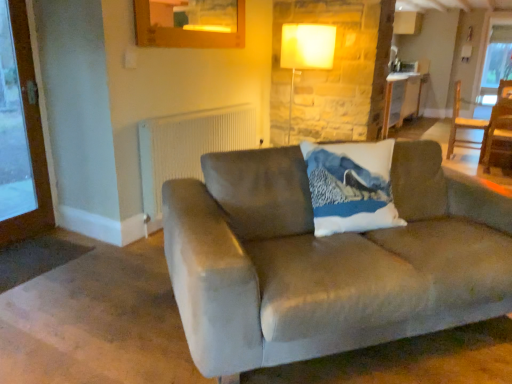
Question: Is wooden chair at right to the right of matte white lamp at upper center from the viewer's perspective?

Choices:
 (A) yes
 (B) no

Answer: (A)

Question: From the image's perspective, does wooden chair at right appear lower than matte white lamp at upper center?

Choices:
 (A) yes
 (B) no

Answer: (A)

Question: From a real-world perspective, is wooden chair at right below matte white lamp at upper center?

Choices:
 (A) no
 (B) yes

Answer: (B)

Question: Is wooden chair at right taller than matte white lamp at upper center?

Choices:
 (A) no
 (B) yes

Answer: (A)

Question: Can you confirm if wooden chair at right is positioned to the left of matte white lamp at upper center?

Choices:
 (A) no
 (B) yes

Answer: (A)

Question: Is suede couch at center wider or thinner than matte white lamp at upper center?

Choices:
 (A) wide
 (B) thin

Answer: (A)

Question: Considering the positions of suede couch at center and matte white lamp at upper center in the image, is suede couch at center taller or shorter than matte white lamp at upper center?

Choices:
 (A) tall
 (B) short

Answer: (B)

Question: Is suede couch at center in front of or behind matte white lamp at upper center in the image?

Choices:
 (A) front
 (B) behind

Answer: (A)

Question: Is point (206, 213) positioned closer to the camera than point (292, 92)?

Choices:
 (A) farther
 (B) closer

Answer: (B)

Question: From the image's perspective, is matte white lamp at upper center positioned above or below white textured radiator at upper center?

Choices:
 (A) below
 (B) above

Answer: (B)

Question: Considering the positions of point (324, 36) and point (244, 135), is point (324, 36) closer or farther from the camera than point (244, 135)?

Choices:
 (A) farther
 (B) closer

Answer: (B)

Question: Is matte white lamp at upper center inside or outside of white textured radiator at upper center?

Choices:
 (A) inside
 (B) outside

Answer: (B)

Question: Considering the relative positions of matte white lamp at upper center and white textured radiator at upper center in the image provided, is matte white lamp at upper center to the left or to the right of white textured radiator at upper center?

Choices:
 (A) left
 (B) right

Answer: (B)

Question: Is suede couch at center situated inside wooden table at center or outside?

Choices:
 (A) outside
 (B) inside

Answer: (A)

Question: In terms of height, does suede couch at center look taller or shorter compared to wooden table at center?

Choices:
 (A) short
 (B) tall

Answer: (A)